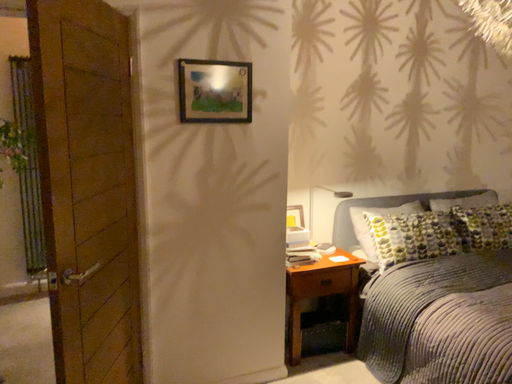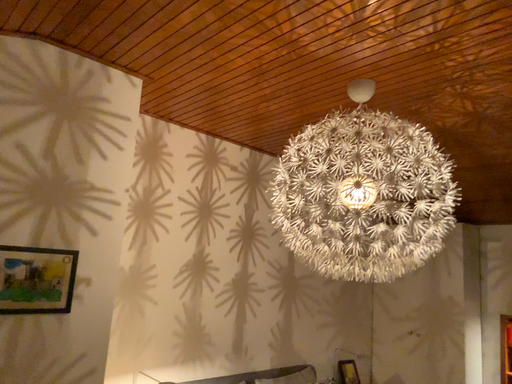
Question: How did the camera likely rotate when shooting the video?

Choices:
 (A) rotated downward
 (B) rotated upward

Answer: (B)